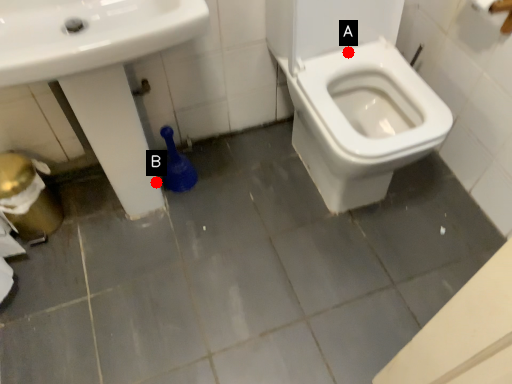
Question: Two points are circled on the image, labeled by A and B beside each circle. Among these points, which one is nearest to the camera?

Choices:
 (A) A is closer
 (B) B is closer

Answer: (A)